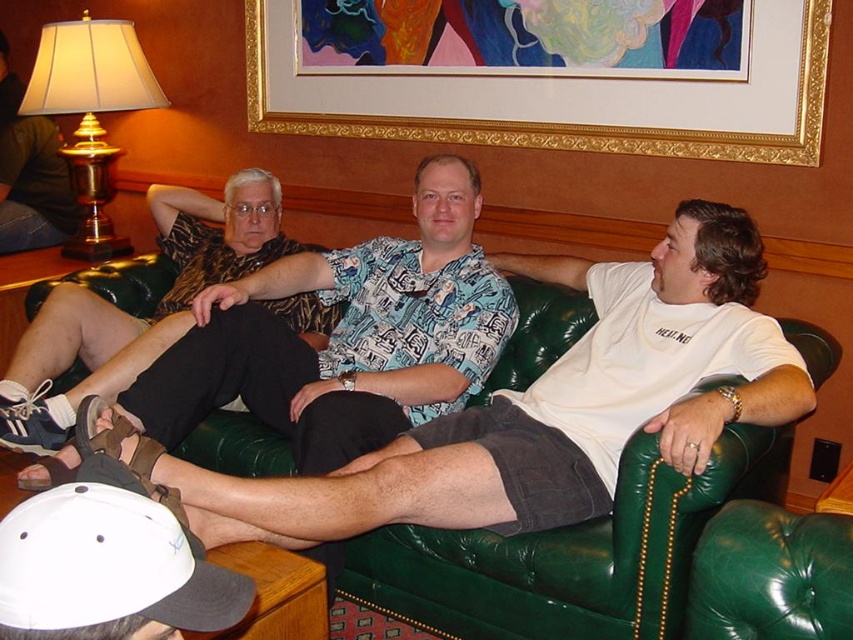
Question: Where is green leather couch at center located in relation to white matte baseball cap at lower left in the image?

Choices:
 (A) left
 (B) right

Answer: (B)

Question: Among these objects, which one is farthest from the camera?

Choices:
 (A) printed fabric shirt at center
 (B) green leather couch at center

Answer: (B)

Question: Which object appears farthest from the camera in this image?

Choices:
 (A) gold-framed picture at upper center
 (B) gold metallic lampshade at upper left
 (C) printed fabric shirt at center
 (D) white matte baseball cap at lower left

Answer: (B)

Question: In this image, where is printed fabric shirt at center located relative to gold metallic lampshade at upper left?

Choices:
 (A) above
 (B) below

Answer: (B)

Question: Which object appears closest to the camera in this image?

Choices:
 (A) gold metallic lampshade at upper left
 (B) white matte baseball cap at lower left

Answer: (B)

Question: Is gold-framed picture at upper center below white matte baseball cap at lower left?

Choices:
 (A) yes
 (B) no

Answer: (B)